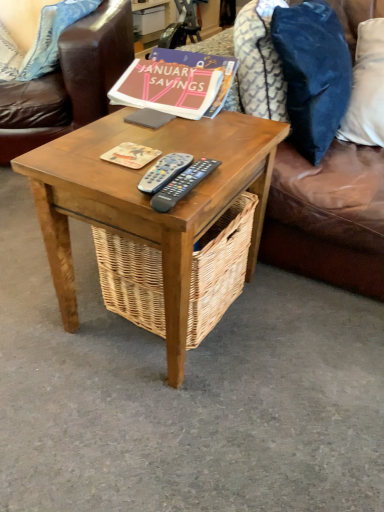
Find the location of a particular element. vacant space situated on the left part of black plastic remote at center, which is the 1th remote control from left to right is located at coordinates (105, 163).